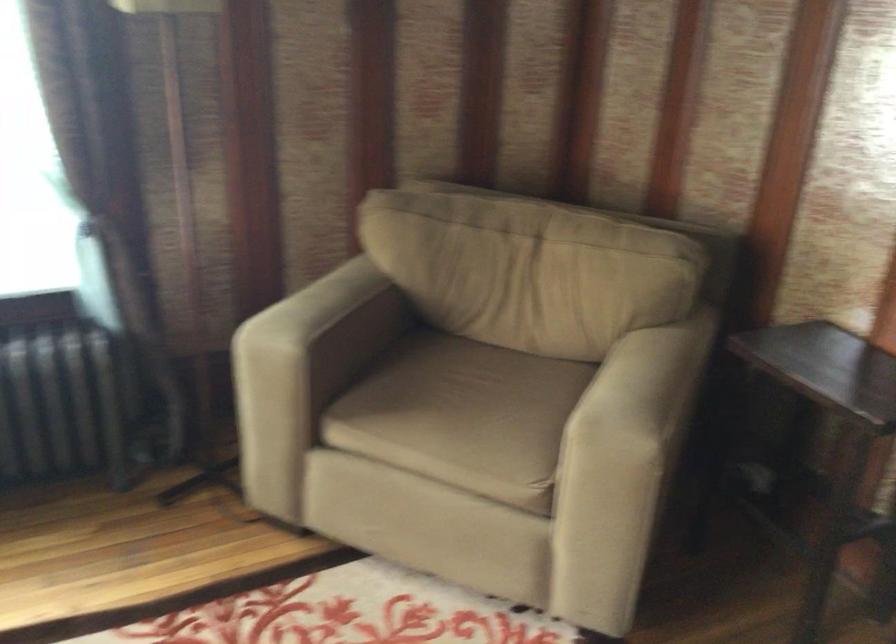
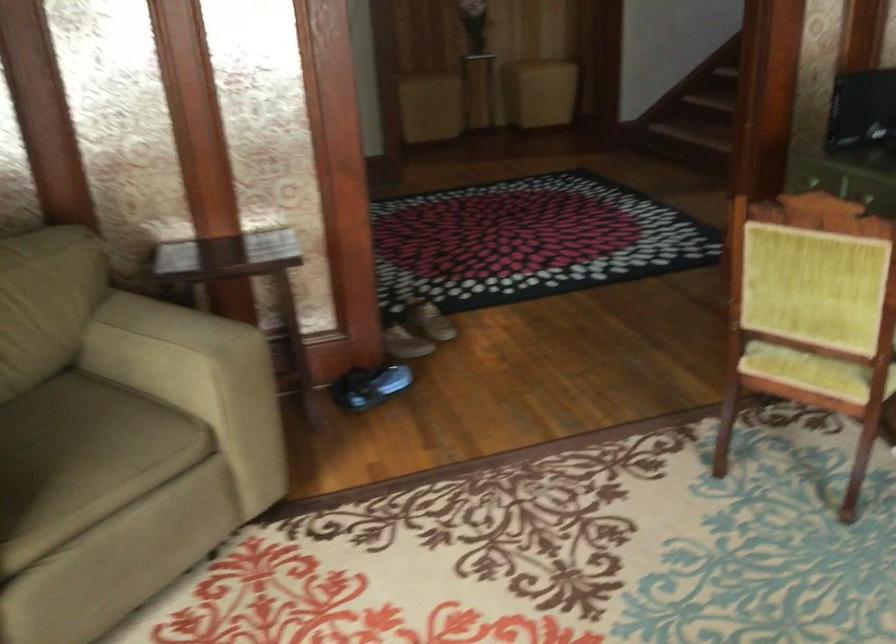
Question: I am providing you with two images of the same scene from different viewpoints. Please identify which objects are invisible in image2.

Choices:
 (A) chair sitting surface
 (B) brown shoe
 (C) yellow ottoman
 (D) none of these

Answer: (D)